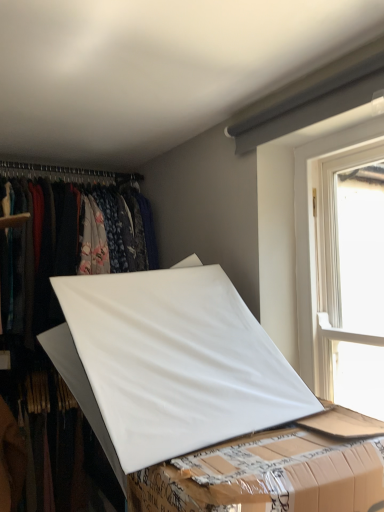
In order to face white matte board at center, should I rotate leftwards or rightwards?

Rotate left and turn 4.753 degrees.

What is the approximate width of white plastic window at upper right?

white plastic window at upper right is 6.53 inches wide.

The width and height of the screenshot is (384, 512). What do you see at coordinates (314, 232) in the screenshot?
I see `white plastic window at upper right` at bounding box center [314, 232].

The height and width of the screenshot is (512, 384). Identify the location of white matte board at center. (170, 362).

Is white plastic window at upper right oriented away from white matte board at center?

No, white plastic window at upper right is not facing the opposite direction of white matte board at center.

Based on the photo, is white plastic window at upper right at the right side of white matte board at center?

Yes, white plastic window at upper right is to the right of white matte board at center.

Who is taller, white plastic window at upper right or white matte board at center?

white plastic window at upper right is taller.

Looking at this image, is white plastic window at upper right placed right next to white matte board at center?

No, white plastic window at upper right is not next to white matte board at center.

Considering the relative sizes of white matte board at center and white matte board at center in the image provided, is white matte board at center thinner than white matte board at center?

Incorrect, the width of white matte board at center is not less than that of white matte board at center.

Is white matte board at center oriented away from white matte board at center?

No, white matte board at center is not facing away from white matte board at center.

Is the depth of white matte board at center greater than that of white matte board at center?

No.

Is white matte board at center inside the boundaries of white matte board at center, or outside?

white matte board at center exists outside the volume of white matte board at center.

Considering their positions, is white matte board at center located in front of or behind white matte board at center?

white matte board at center is positioned farther from the viewer than white matte board at center.

Is white matte board at center wider than white matte board at center?

No.

Considering the sizes of objects white matte board at center and white matte board at center in the image provided, who is smaller, white matte board at center or white matte board at center?

white matte board at center.

How many degrees apart are the facing directions of white matte board at center and white plastic window at upper right?

The angle between the facing direction of white matte board at center and the facing direction of white plastic window at upper right is 3.37 degrees.

From the image's perspective, which is above, white matte board at center or white plastic window at upper right?

white plastic window at upper right.

From a real-world perspective, which is physically above, white matte board at center or white plastic window at upper right?

In real-world perspective, white plastic window at upper right is above.

The image size is (384, 512). I want to click on linen that is in front of the white plastic window at upper right, so click(170, 362).

Is white plastic window at upper right oriented away from white matte board at center?

No.

From a real-world perspective, who is located higher, white plastic window at upper right or white matte board at center?

white plastic window at upper right is physically above.

How many degrees apart are the facing directions of white plastic window at upper right and white matte board at center?

95.1 degrees separate the facing orientations of white plastic window at upper right and white matte board at center.

From the picture: Is white plastic window at upper right located within white matte board at center?

No, white plastic window at upper right is not a part of white matte board at center.

Is white matte board at center closer to camera compared to white plastic window at upper right?

Yes, it is in front of white plastic window at upper right.

Is white matte board at center facing away from white plastic window at upper right?

No, white matte board at center's orientation is not away from white plastic window at upper right.

From the image's perspective, does white matte board at center appear lower than white plastic window at upper right?

Yes.

Identify the location of table in front of the white plastic window at upper right. (267, 475).

Where is `linen on the left of white matte board at center`? linen on the left of white matte board at center is located at coordinates (170, 362).

Estimate the real-world distances between objects in this image. Which object is further from white plastic window at upper right, white matte board at center or white matte board at center?

Among the two, white matte board at center is located further to white plastic window at upper right.

Looking at the image, which one is located closer to white matte board at center, white matte board at center or white plastic window at upper right?

white matte board at center lies closer to white matte board at center than the other object.

From the image, which object appears to be farther from white matte board at center, white plastic window at upper right or white matte board at center?

white plastic window at upper right is further to white matte board at center.

Estimate the real-world distances between objects in this image. Which object is further from white matte board at center, white matte board at center or white plastic window at upper right?

white plastic window at upper right.

From the image, which object appears to be farther from white matte board at center, white plastic window at upper right or white matte board at center?

The object further to white matte board at center is white plastic window at upper right.

Estimate the real-world distances between objects in this image. Which object is further from white plastic window at upper right, white matte board at center or white matte board at center?

white matte board at center.

Where is `table between white matte board at center and white plastic window at upper right`? The width and height of the screenshot is (384, 512). table between white matte board at center and white plastic window at upper right is located at coordinates click(x=267, y=475).